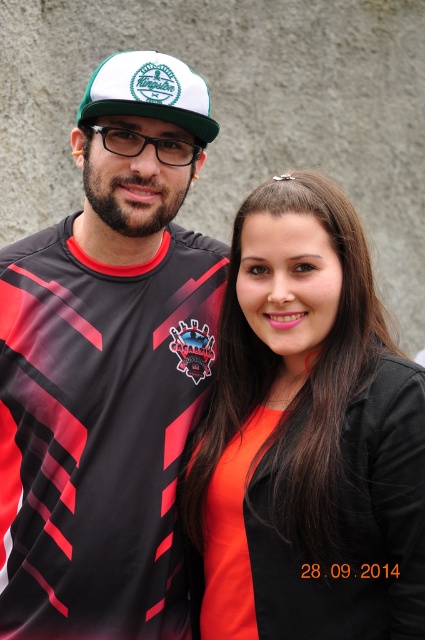
Question: Observing the image, what is the correct spatial positioning of matte jersey at center in reference to white matte baseball cap at upper center?

Choices:
 (A) left
 (B) right

Answer: (A)

Question: Which point appears closest to the camera in this image?

Choices:
 (A) (122, 54)
 (B) (93, 106)
 (C) (376, 531)

Answer: (C)

Question: Is orange matte shirt at center bigger than white matte baseball cap at upper center?

Choices:
 (A) yes
 (B) no

Answer: (B)

Question: Estimate the real-world distances between objects in this image. Which object is farther from the orange matte shirt at center?

Choices:
 (A) white matte baseball cap at upper center
 (B) matte jersey at center

Answer: (B)

Question: Which object is the closest to the white matte baseball cap at upper center?

Choices:
 (A) orange matte shirt at center
 (B) matte jersey at center

Answer: (B)

Question: Can you confirm if matte jersey at center is smaller than white matte baseball cap at upper center?

Choices:
 (A) yes
 (B) no

Answer: (B)